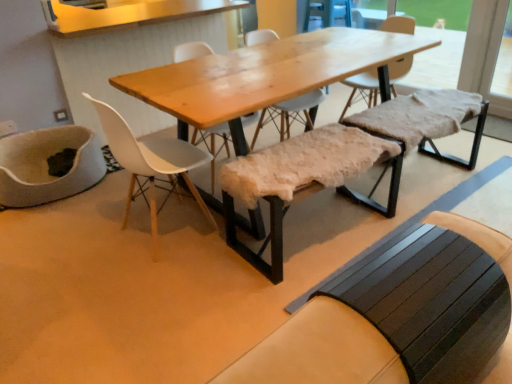
Question: Does fuzzy sheepskin bench at center, marked as the second church bench in a back-to-front arrangement, have a smaller size compared to fuzzy sheepskin bench at center, which is the 3th church bench from front to back?

Choices:
 (A) yes
 (B) no

Answer: (B)

Question: Is fuzzy sheepskin bench at center, which is the 3th church bench from front to back, completely or partially inside fuzzy sheepskin bench at center, marked as the second church bench in a back-to-front arrangement?

Choices:
 (A) no
 (B) yes

Answer: (A)

Question: Is fuzzy sheepskin bench at center, the second church bench from the front, turned away from fuzzy sheepskin bench at center, the 1th church bench in the back-to-front sequence?

Choices:
 (A) yes
 (B) no

Answer: (B)

Question: From the image's perspective, is fuzzy sheepskin bench at center, the second church bench from the front, on fuzzy sheepskin bench at center, the 1th church bench in the back-to-front sequence?

Choices:
 (A) yes
 (B) no

Answer: (B)

Question: Can you confirm if fuzzy sheepskin bench at center, the second church bench from the front, is positioned to the right of fuzzy sheepskin bench at center, the 1th church bench in the back-to-front sequence?

Choices:
 (A) yes
 (B) no

Answer: (B)

Question: Relative to fuzzy sheepskin bench at center, marked as the second church bench in a back-to-front arrangement, is natural wood table at center in front or behind?

Choices:
 (A) front
 (B) behind

Answer: (B)

Question: Based on their sizes in the image, would you say natural wood table at center is bigger or smaller than fuzzy sheepskin bench at center, marked as the second church bench in a back-to-front arrangement?

Choices:
 (A) big
 (B) small

Answer: (A)

Question: From their relative heights in the image, would you say natural wood table at center is taller or shorter than fuzzy sheepskin bench at center, marked as the second church bench in a back-to-front arrangement?

Choices:
 (A) short
 (B) tall

Answer: (B)

Question: Is natural wood table at center to the left or to the right of fuzzy sheepskin bench at center, marked as the second church bench in a back-to-front arrangement, in the image?

Choices:
 (A) right
 (B) left

Answer: (B)

Question: Is natural wood table at center wider or thinner than dark brown wooden bench at lower right, positioned as the third church bench in back-to-front order?

Choices:
 (A) thin
 (B) wide

Answer: (B)

Question: From a real-world perspective, is natural wood table at center physically located above or below dark brown wooden bench at lower right, the 1th church bench when ordered from front to back?

Choices:
 (A) below
 (B) above

Answer: (A)

Question: Looking at the image, does natural wood table at center seem bigger or smaller compared to dark brown wooden bench at lower right, the 1th church bench when ordered from front to back?

Choices:
 (A) small
 (B) big

Answer: (B)

Question: Considering the positions of natural wood table at center and dark brown wooden bench at lower right, the 1th church bench when ordered from front to back, in the image, is natural wood table at center taller or shorter than dark brown wooden bench at lower right, the 1th church bench when ordered from front to back,?

Choices:
 (A) short
 (B) tall

Answer: (B)

Question: Considering the positions of dark brown wooden bench at lower right, the 1th church bench when ordered from front to back, and fuzzy sheepskin bench at center, marked as the second church bench in a back-to-front arrangement, in the image, is dark brown wooden bench at lower right, the 1th church bench when ordered from front to back, taller or shorter than fuzzy sheepskin bench at center, marked as the second church bench in a back-to-front arrangement,?

Choices:
 (A) short
 (B) tall

Answer: (A)

Question: Considering the positions of dark brown wooden bench at lower right, the 1th church bench when ordered from front to back, and fuzzy sheepskin bench at center, the second church bench from the front, in the image, is dark brown wooden bench at lower right, the 1th church bench when ordered from front to back, bigger or smaller than fuzzy sheepskin bench at center, the second church bench from the front,?

Choices:
 (A) big
 (B) small

Answer: (B)